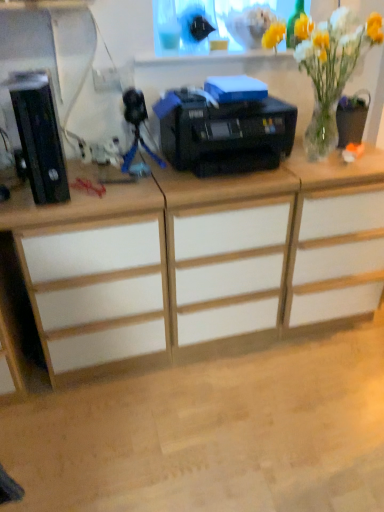
Question: From the image's perspective, is white matte desk at left located above or below blue plastic tripod at center?

Choices:
 (A) above
 (B) below

Answer: (B)

Question: Considering the positions of white matte desk at left and blue plastic tripod at center in the image, is white matte desk at left wider or thinner than blue plastic tripod at center?

Choices:
 (A) thin
 (B) wide

Answer: (B)

Question: Which of these objects is positioned farthest from the black plastic computer tower at left?

Choices:
 (A) black plastic printer at center
 (B) blue plastic tripod at center
 (C) white matte drawer at center
 (D) white wood cabinet at center
 (E) white matte desk at left

Answer: (D)

Question: Which object is positioned farthest from the black plastic printer at center?

Choices:
 (A) white matte drawer at center
 (B) black plastic computer tower at left
 (C) white matte desk at left
 (D) blue plastic tripod at center
 (E) white wood cabinet at center

Answer: (B)